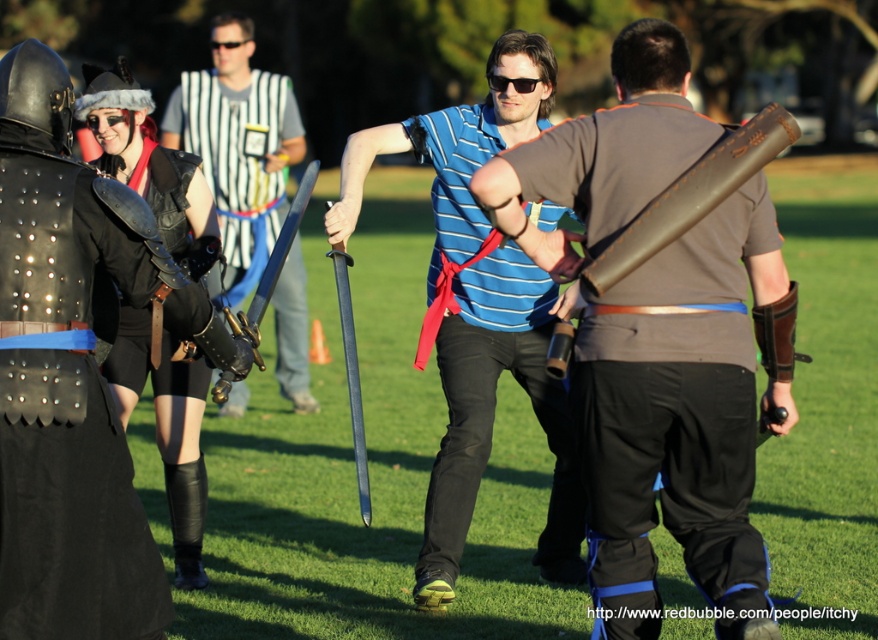
Is point (660, 296) more distant than point (531, 300)?

No, (660, 296) is in front of (531, 300).

Does matte brown leather sword at center lie in front of blue striped shirt at center?

Yes, it is.

You are a GUI agent. You are given a task and a screenshot of the screen. Output one action in this format:
    pyautogui.click(x=<x>, y=<y>)
    Task: Click on the matte brown leather sword at center
    The height and width of the screenshot is (640, 878).
    Given the screenshot: What is the action you would take?
    pyautogui.click(x=677, y=420)

Does brown leather scroll at right have a greater width compared to shiny silver sword at center?

→ In fact, brown leather scroll at right might be narrower than shiny silver sword at center.

Who is positioned more to the left, brown leather scroll at right or shiny silver sword at center?

shiny silver sword at center is more to the left.

Does point (694, 189) come behind point (245, 314)?

No, it is not.

Where is `brown leather scroll at right`? The width and height of the screenshot is (878, 640). brown leather scroll at right is located at coordinates (692, 195).

Is point (342, 323) farther from camera compared to point (271, 256)?

No, (342, 323) is closer to viewer.

Is point (362, 500) farther from viewer compared to point (255, 317)?

Yes, point (362, 500) is behind point (255, 317).

Where is `polished steel sword at center`? The image size is (878, 640). polished steel sword at center is located at coordinates (351, 376).